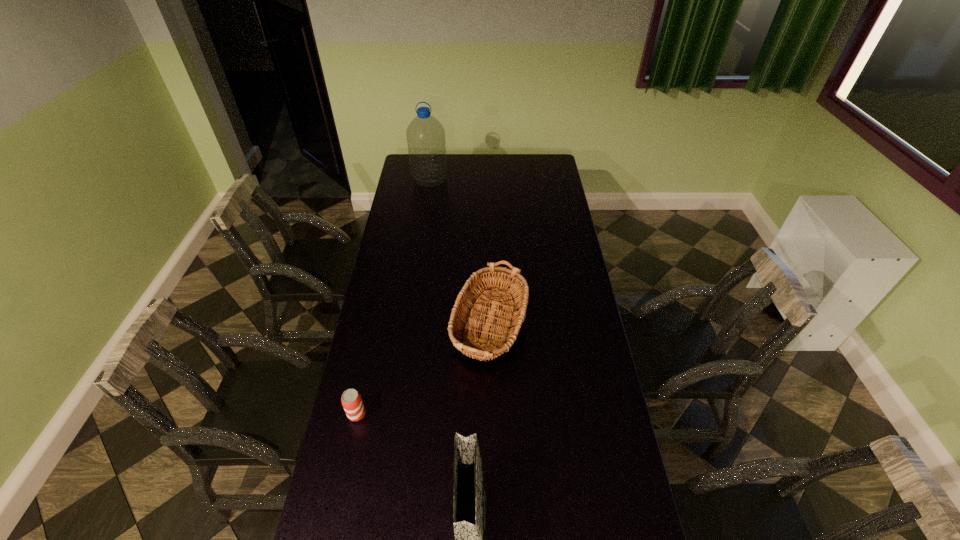
This screenshot has height=540, width=960. I want to click on water jug that is at the left edge, so click(x=425, y=134).

Locate an element on the screen. Image resolution: width=960 pixels, height=540 pixels. beer can that is at the left edge is located at coordinates (351, 399).

You are a GUI agent. You are given a task and a screenshot of the screen. Output one action in this format:
    pyautogui.click(x=<x>, y=<y>)
    Task: Click on the object positioned at the far left corner
    The height and width of the screenshot is (540, 960).
    Given the screenshot: What is the action you would take?
    pyautogui.click(x=425, y=134)

You are a GUI agent. You are given a task and a screenshot of the screen. Output one action in this format:
    pyautogui.click(x=<x>, y=<y>)
    Task: Click on the free space at the left edge
    The height and width of the screenshot is (540, 960).
    Given the screenshot: What is the action you would take?
    pyautogui.click(x=353, y=373)

Find the location of a particular element. blank space at the right edge of the desktop is located at coordinates (574, 291).

Find the location of a particular element. vacant space at the far right corner is located at coordinates (535, 156).

Where is `free spot between the second shortest object and the tallest object`? This screenshot has height=540, width=960. free spot between the second shortest object and the tallest object is located at coordinates 456,255.

You are a GUI agent. You are given a task and a screenshot of the screen. Output one action in this format:
    pyautogui.click(x=<x>, y=<y>)
    Task: Click on the vacant region between the third nearest object and the farthest object
    This screenshot has width=960, height=540.
    Given the screenshot: What is the action you would take?
    pyautogui.click(x=456, y=255)

This screenshot has height=540, width=960. What are the coordinates of `vacant region between the water jug and the basket` in the screenshot? It's located at click(x=456, y=255).

Where is `unoccupied area between the tallest object and the third nearest object`? Image resolution: width=960 pixels, height=540 pixels. unoccupied area between the tallest object and the third nearest object is located at coordinates (456, 255).